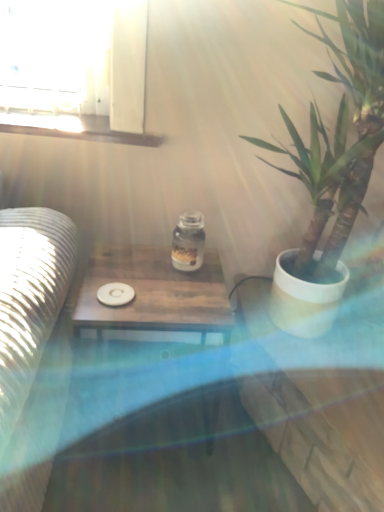
This screenshot has width=384, height=512. What do you see at coordinates (115, 294) in the screenshot? I see `white matte coaster at center` at bounding box center [115, 294].

In order to face transparent glass jar at center, should I rotate leftwards or rightwards?

Rotate your view left by about 0.752°.

Identify the location of wooden table at center. (154, 298).

From a real-world perspective, which is physically below, wooden table at center or white matte coaster at center?

wooden table at center.

Between point (155, 329) and point (122, 289), which one is positioned behind?

The point (122, 289) is farther.

How many degrees apart are the facing directions of wooden table at center and white matte coaster at center?

0.00137 degrees separate the facing orientations of wooden table at center and white matte coaster at center.

Is white matte coaster at center at the left side of green leafy plant in white pot at right?

Correct, you'll find white matte coaster at center to the left of green leafy plant in white pot at right.

Which is in front, white matte coaster at center or green leafy plant in white pot at right?

green leafy plant in white pot at right.

Can you confirm if white matte coaster at center is taller than green leafy plant in white pot at right?

No, white matte coaster at center is not taller than green leafy plant in white pot at right.

From a real-world perspective, is white matte coaster at center above or below green leafy plant in white pot at right?

Clearly, from a real-world perspective, white matte coaster at center is below green leafy plant in white pot at right.

Is green leafy plant in white pot at right thinner than transparent glass jar at center?

Incorrect, the width of green leafy plant in white pot at right is not less than that of transparent glass jar at center.

Relative to transparent glass jar at center, is green leafy plant in white pot at right in front or behind?

In the image, green leafy plant in white pot at right appears in front of transparent glass jar at center.

Which of these two, green leafy plant in white pot at right or transparent glass jar at center, stands shorter?

With less height is transparent glass jar at center.

Is green leafy plant in white pot at right next to transparent glass jar at center and touching it?

No, green leafy plant in white pot at right is not beside transparent glass jar at center.

Based on their sizes in the image, would you say transparent glass jar at center is bigger or smaller than white matte coaster at center?

transparent glass jar at center is bigger than white matte coaster at center.

Could you tell me if transparent glass jar at center is turned towards white matte coaster at center?

No, transparent glass jar at center is not aimed at white matte coaster at center.

From the image's perspective, which is above, transparent glass jar at center or white matte coaster at center?

transparent glass jar at center, from the image's perspective.

Does transparent glass jar at center lie behind white matte coaster at center?

Yes, transparent glass jar at center is behind white matte coaster at center.

Can you see green leafy plant in white pot at right touching wooden table at center?

No.

From the image's perspective, does green leafy plant in white pot at right appear higher than wooden table at center?

Yes, from the image's perspective, green leafy plant in white pot at right is over wooden table at center.

Which object is thinner, green leafy plant in white pot at right or wooden table at center?

wooden table at center.

Does transparent glass jar at center come behind green leafy plant in white pot at right?

Yes, the depth of transparent glass jar at center is greater than that of green leafy plant in white pot at right.

Considering the positions of points (184, 226) and (334, 267), is point (184, 226) farther from camera compared to point (334, 267)?

No, (184, 226) is in front of (334, 267).

Is there a large distance between transparent glass jar at center and green leafy plant in white pot at right?

No, there isn't a large distance between transparent glass jar at center and green leafy plant in white pot at right.

Which is in front, point (120, 295) or point (105, 267)?

The point (120, 295) is closer.

Find the location of a particular element. coaster that is above the wooden table at center (from a real-world perspective) is located at coordinates (115, 294).

Looking at the image, does white matte coaster at center seem bigger or smaller compared to wooden table at center?

Considering their sizes, white matte coaster at center takes up less space than wooden table at center.

Find the location of `table in front of the white matte coaster at center`. table in front of the white matte coaster at center is located at coordinates (154, 298).

Where is `coaster that is under the green leafy plant in white pot at right (from a real-world perspective)`? coaster that is under the green leafy plant in white pot at right (from a real-world perspective) is located at coordinates [x=115, y=294].

Considering their positions, is green leafy plant in white pot at right positioned closer to wooden table at center than white matte coaster at center?

white matte coaster at center.

From the image, which object appears to be farther from wooden table at center, transparent glass jar at center or white matte coaster at center?

transparent glass jar at center.

When comparing their distances from green leafy plant in white pot at right, does white matte coaster at center or wooden table at center seem closer?

wooden table at center is positioned closer to the anchor green leafy plant in white pot at right.

When comparing their distances from wooden table at center, does transparent glass jar at center or green leafy plant in white pot at right seem further?

The object further to wooden table at center is green leafy plant in white pot at right.

When comparing their distances from green leafy plant in white pot at right, does transparent glass jar at center or wooden table at center seem further?

wooden table at center.

Estimate the real-world distances between objects in this image. Which object is further from transparent glass jar at center, white matte coaster at center or wooden table at center?

Based on the image, white matte coaster at center appears to be further to transparent glass jar at center.

Based on their spatial positions, is white matte coaster at center or green leafy plant in white pot at right closer to wooden table at center?

white matte coaster at center is positioned closer to the anchor wooden table at center.

Considering their positions, is wooden table at center positioned closer to green leafy plant in white pot at right than white matte coaster at center?

Among the two, wooden table at center is located nearer to green leafy plant in white pot at right.

The height and width of the screenshot is (512, 384). Identify the location of table between white matte coaster at center and green leafy plant in white pot at right in the horizontal direction. coord(154,298).

At what (x,y) coordinates should I click in order to perform the action: click on coaster between transparent glass jar at center and wooden table at center in the vertical direction. Please return your answer as a coordinate pair (x, y). Image resolution: width=384 pixels, height=512 pixels. Looking at the image, I should click on (115, 294).

This screenshot has width=384, height=512. I want to click on glass jar between wooden table at center and green leafy plant in white pot at right in the horizontal direction, so click(x=188, y=242).

Identify the location of glass jar located between white matte coaster at center and green leafy plant in white pot at right in the left-right direction. point(188,242).